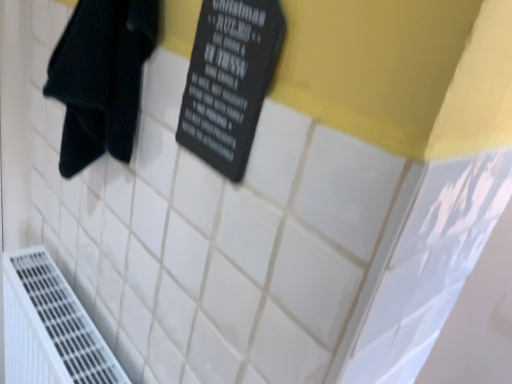
Question: Is white plastic air conditioning at lower left shorter than black fabric towel at left?

Choices:
 (A) yes
 (B) no

Answer: (B)

Question: Is white plastic air conditioning at lower left oriented towards black fabric towel at left?

Choices:
 (A) no
 (B) yes

Answer: (A)

Question: Does white plastic air conditioning at lower left appear on the right side of black fabric towel at left?

Choices:
 (A) no
 (B) yes

Answer: (A)

Question: From a real-world perspective, is white plastic air conditioning at lower left below black fabric towel at left?

Choices:
 (A) no
 (B) yes

Answer: (B)

Question: From the image's perspective, is white plastic air conditioning at lower left above black fabric towel at left?

Choices:
 (A) yes
 (B) no

Answer: (B)

Question: From a real-world perspective, is white plastic air conditioning at lower left over black fabric towel at left?

Choices:
 (A) no
 (B) yes

Answer: (A)

Question: Is white plastic air conditioning at lower left oriented away from black matte sign at upper center?

Choices:
 (A) yes
 (B) no

Answer: (B)

Question: Considering the relative positions of white plastic air conditioning at lower left and black matte sign at upper center in the image provided, is white plastic air conditioning at lower left to the right of black matte sign at upper center from the viewer's perspective?

Choices:
 (A) no
 (B) yes

Answer: (A)

Question: Is white plastic air conditioning at lower left not close to black matte sign at upper center?

Choices:
 (A) yes
 (B) no

Answer: (B)

Question: Could you tell me if white plastic air conditioning at lower left is facing black matte sign at upper center?

Choices:
 (A) no
 (B) yes

Answer: (A)

Question: From a real-world perspective, does white plastic air conditioning at lower left sit lower than black matte sign at upper center?

Choices:
 (A) yes
 (B) no

Answer: (A)

Question: Does white plastic air conditioning at lower left have a greater width compared to black matte sign at upper center?

Choices:
 (A) yes
 (B) no

Answer: (A)

Question: Does black matte sign at upper center come behind black fabric towel at left?

Choices:
 (A) yes
 (B) no

Answer: (B)